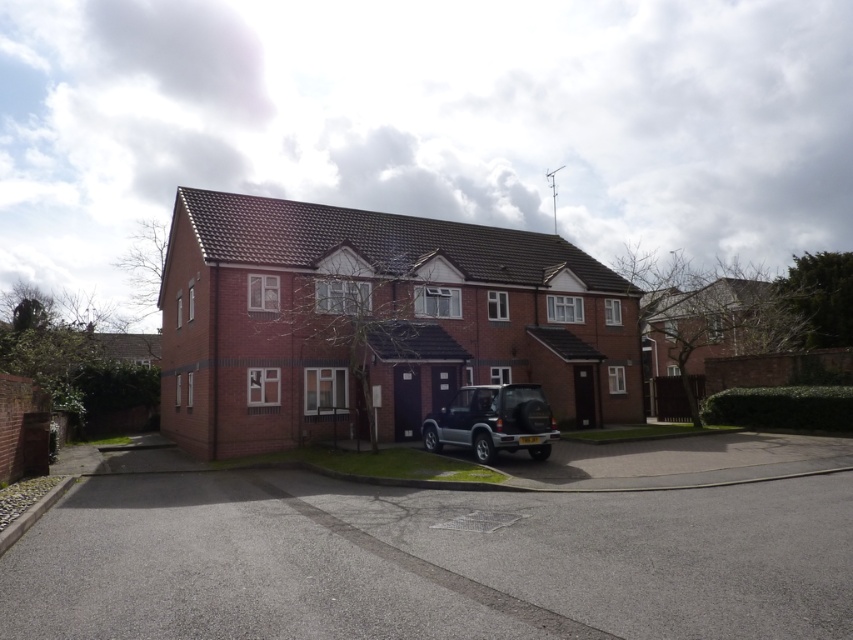
The height and width of the screenshot is (640, 853). Describe the element at coordinates (428, 561) in the screenshot. I see `gray asphalt driveway at center` at that location.

In the scene shown: Who is more forward, (505, 602) or (486, 442)?

Positioned in front is point (505, 602).

Find the location of `gray asphalt driveway at center`. gray asphalt driveway at center is located at coordinates (428, 561).

Between brick house at center and satin black suv at center, which one is positioned higher?

Positioned higher is brick house at center.

Who is lower down, brick house at center or satin black suv at center?

satin black suv at center

Is point (254, 196) less distant than point (494, 452)?

That is False.

I want to click on brick house at center, so click(x=375, y=321).

Who is positioned more to the right, gray asphalt driveway at center or brick house at center?

gray asphalt driveway at center is more to the right.

Does point (488, 580) come closer to viewer compared to point (218, 195)?

Yes, point (488, 580) is in front of point (218, 195).

Describe the element at coordinates (428, 561) in the screenshot. This screenshot has width=853, height=640. I see `gray asphalt driveway at center` at that location.

At what (x,y) coordinates should I click in order to perform the action: click on gray asphalt driveway at center. Please return your answer as a coordinate pair (x, y). Looking at the image, I should click on (428, 561).